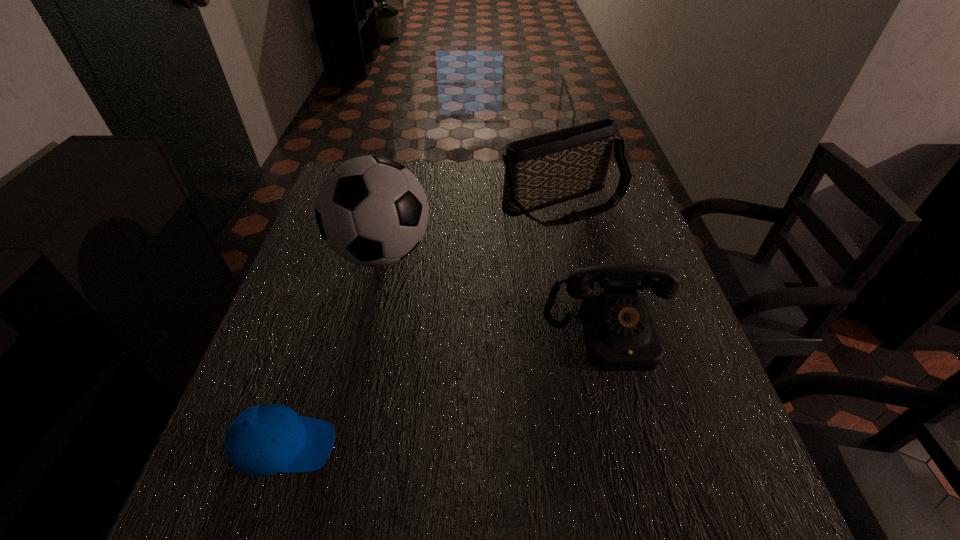
Image resolution: width=960 pixels, height=540 pixels. I want to click on the tallest object, so click(x=372, y=211).

This screenshot has width=960, height=540. I want to click on the second tallest object, so click(x=543, y=170).

Identify the location of the third tallest object. (620, 335).

This screenshot has height=540, width=960. What are the coordinates of `telephone` in the screenshot? It's located at click(x=620, y=335).

Find the location of a particular element. The image size is (960, 540). cap is located at coordinates (262, 440).

The image size is (960, 540). Identify the location of the nearest object. (262, 440).

Identify the location of vacant space located 0.280m on the right of the soccer ball. (540, 253).

Find the location of a particular element. This screenshot has height=540, width=960. blank area located on the left of the third shortest object is located at coordinates (393, 205).

Where is `free space located 0.270m on the dial of the telephone`? The image size is (960, 540). free space located 0.270m on the dial of the telephone is located at coordinates (655, 518).

Where is `blank space located 0.350m on the front-facing side of the shortest object`? blank space located 0.350m on the front-facing side of the shortest object is located at coordinates (533, 446).